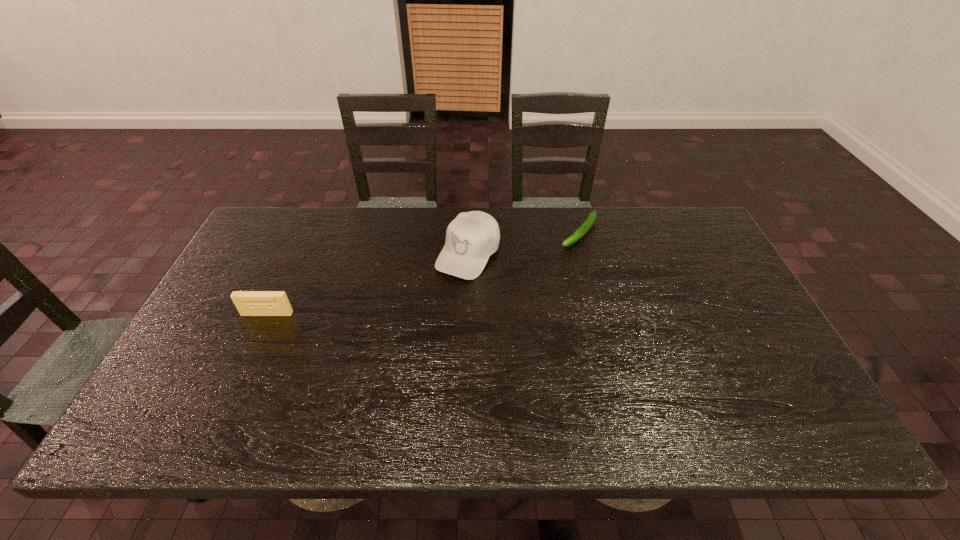
This screenshot has width=960, height=540. Find the location of `free spot located on the front-facing side of the tallest object`. free spot located on the front-facing side of the tallest object is located at coordinates (444, 291).

Find the location of `vacant space located 0.380m on the front-facing side of the tallest object`. vacant space located 0.380m on the front-facing side of the tallest object is located at coordinates (377, 382).

You are a GUI agent. You are given a task and a screenshot of the screen. Output one action in this format:
    pyautogui.click(x=<x>, y=<y>)
    Task: Click on the free location located on the front-facing side of the tallest object
    Image resolution: width=960 pixels, height=540 pixels.
    Given the screenshot: What is the action you would take?
    pyautogui.click(x=417, y=328)

This screenshot has width=960, height=540. In order to click on blank area located 0.210m on the front-facing side of the zucchini in this screenshot , I will do `click(535, 284)`.

You are a GUI agent. You are given a task and a screenshot of the screen. Output one action in this format:
    pyautogui.click(x=<x>, y=<y>)
    Task: Click on the vacant space located on the front-facing side of the zucchini
    This screenshot has height=540, width=960.
    Given the screenshot: What is the action you would take?
    pyautogui.click(x=535, y=284)

At what (x,y) coordinates should I click in order to perform the action: click on vacant space located 0.110m on the front-facing side of the zucchini. Please return your answer as a coordinate pair (x, y). Looking at the image, I should click on (552, 265).

Locate an element on the screen. baseball cap that is at the far edge is located at coordinates (471, 238).

At what (x,y) coordinates should I click in order to perform the action: click on zucchini that is positioned at the far edge. Please return your answer as a coordinate pair (x, y). The height and width of the screenshot is (540, 960). Looking at the image, I should click on (586, 226).

Identify the location of object located at the left edge. (248, 303).

This screenshot has height=540, width=960. In order to click on vacant position at the far edge of the desktop in this screenshot , I will do `click(358, 252)`.